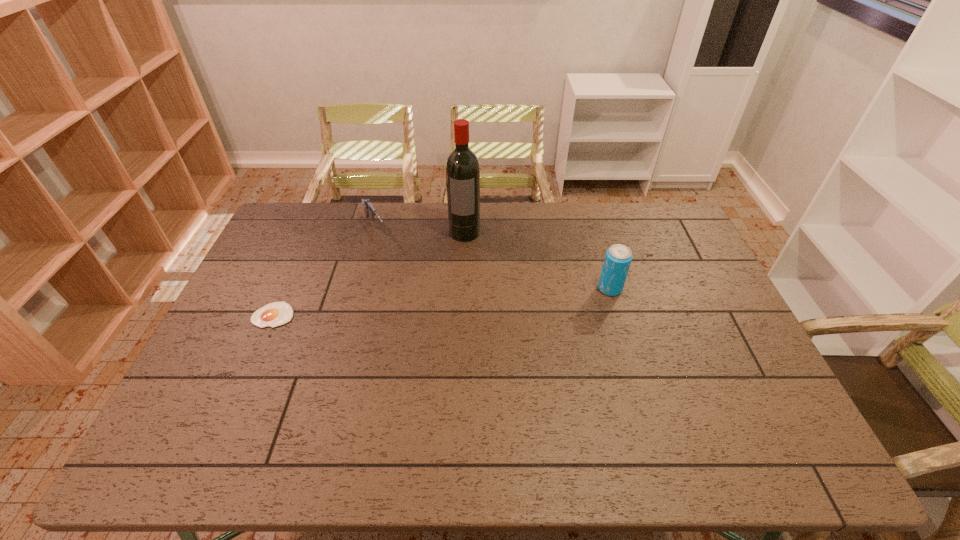
Find the location of `free spot on the desktop that is between the leftmost object and the rightmost object and is positioned on the label of the wine bottle`. free spot on the desktop that is between the leftmost object and the rightmost object and is positioned on the label of the wine bottle is located at coordinates (458, 301).

You are a GUI agent. You are given a task and a screenshot of the screen. Output one action in this format:
    pyautogui.click(x=<x>, y=<y>)
    Task: Click on the free space on the desktop that is between the shortest object and the third farthest object and is positioned at the barrel of the second shortest object
    
    Given the screenshot: What is the action you would take?
    pyautogui.click(x=425, y=303)